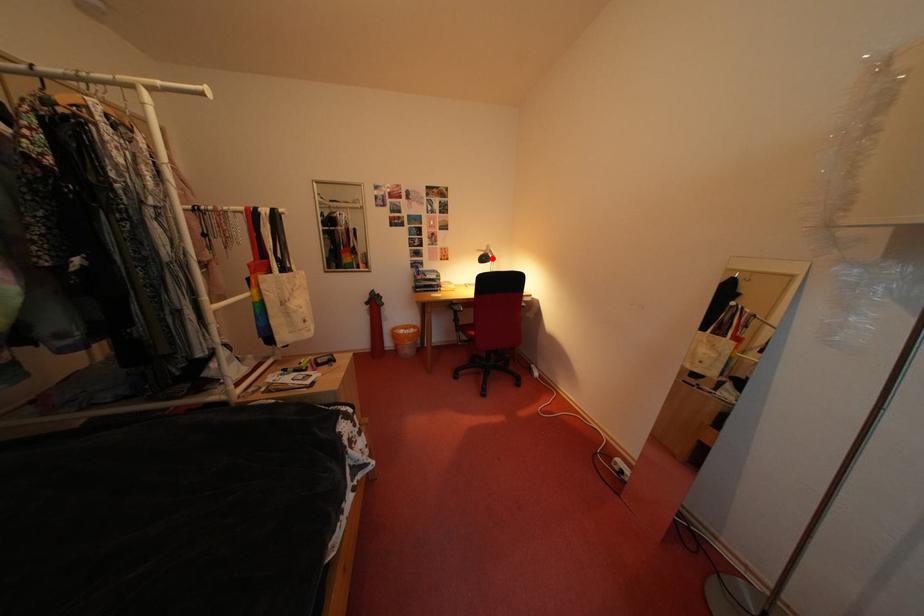
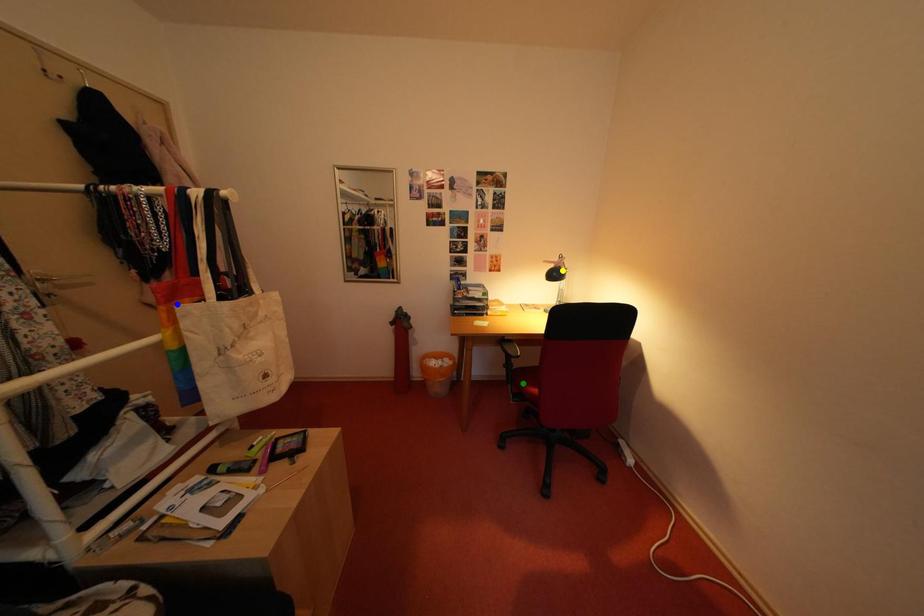
Question: I am providing you with two images of the same scene from different viewpoints. A red point is marked on the first image. You are given multiple points on the second image. Can you choose the point in image 2 that corresponds to the point in image 1?

Choices:
 (A) yellow point
 (B) green point
 (C) blue point

Answer: (A)